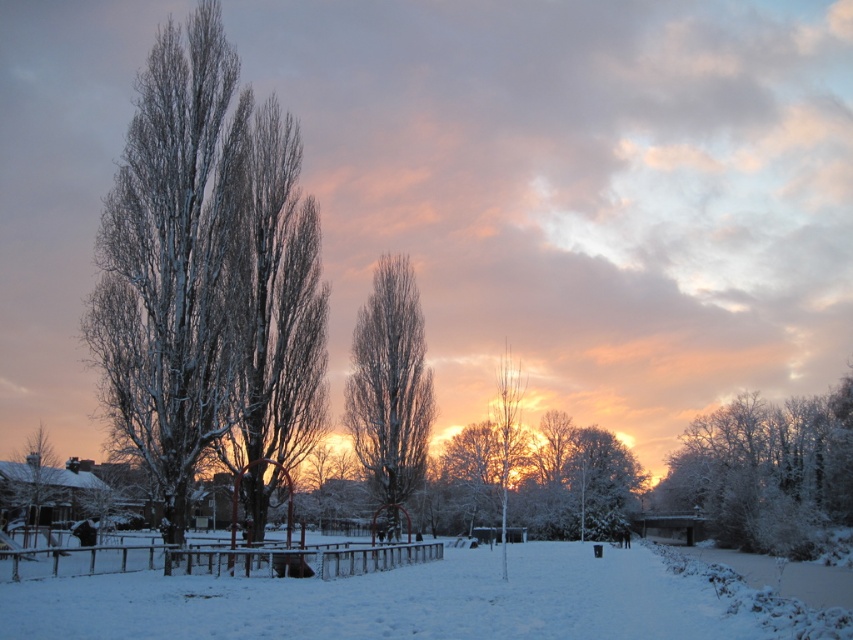
Does point (798, 403) come in front of point (575, 438)?

Yes, it is.

Is white frosty trees at right taller than white snow-covered tree at center?

Yes, white frosty trees at right is taller than white snow-covered tree at center.

Is point (817, 541) closer to camera compared to point (634, 493)?

That is True.

Find the location of `white frosty trees at right`. white frosty trees at right is located at coordinates (766, 472).

Is metallic silver fence at lower center further to the viewer compared to white snow-covered tree at center?

No, it is in front of white snow-covered tree at center.

Is metallic silver fence at lower center to the left of white snow-covered tree at center from the viewer's perspective?

Correct, you'll find metallic silver fence at lower center to the left of white snow-covered tree at center.

The width and height of the screenshot is (853, 640). What are the coordinates of `metallic silver fence at lower center` in the screenshot? It's located at (215, 560).

Can you confirm if snow-covered tree at center is taller than white smooth tree at center?

Correct, snow-covered tree at center is much taller as white smooth tree at center.

Between point (418, 310) and point (495, 440), which one is positioned behind?

The point (495, 440) is behind.

Is point (355, 365) positioned before point (503, 403)?

No, (355, 365) is behind (503, 403).

The width and height of the screenshot is (853, 640). I want to click on snow-covered tree at center, so click(x=390, y=384).